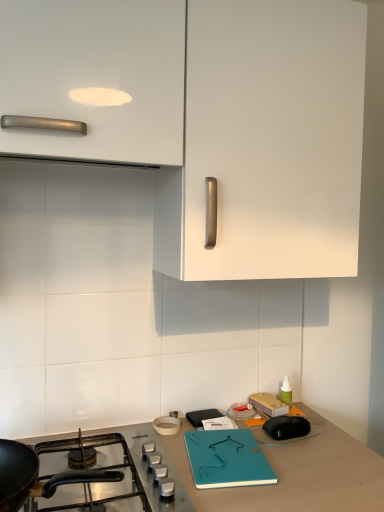
Image resolution: width=384 pixels, height=512 pixels. What do you see at coordinates (70, 476) in the screenshot?
I see `black matte gas stove at lower left` at bounding box center [70, 476].

What is the approximate width of black matte gas stove at lower left?

It is 11.25 inches.

Find the location of a particular element. This screenshot has width=384, height=512. black matte gas stove at lower left is located at coordinates (70, 476).

Describe the element at coordinates (209, 120) in the screenshot. The image size is (384, 512). I see `white matte cabinet at upper center` at that location.

Find the location of `white matte cabinet at upper center`. white matte cabinet at upper center is located at coordinates (209, 120).

Find the location of `black matte gas stove at lower left`. black matte gas stove at lower left is located at coordinates (70, 476).

Can you confirm if white matte cabinet at upper center is positioned to the right of black matte gas stove at lower left?

Correct, you'll find white matte cabinet at upper center to the right of black matte gas stove at lower left.

Which object is closer to the camera taking this photo, white matte cabinet at upper center or black matte gas stove at lower left?

black matte gas stove at lower left is in front.

In the scene shown: Which point is more distant from viewer, (x=131, y=78) or (x=15, y=483)?

The point (x=131, y=78) is farther.

From the image's perspective, who appears lower, white matte cabinet at upper center or black matte gas stove at lower left?

black matte gas stove at lower left.

From a real-world perspective, is white matte cabinet at upper center located higher than black matte gas stove at lower left?

Yes.

Considering the sizes of objects white matte cabinet at upper center and black matte gas stove at lower left in the image provided, who is thinner, white matte cabinet at upper center or black matte gas stove at lower left?

black matte gas stove at lower left.

Who is shorter, white matte cabinet at upper center or black matte gas stove at lower left?

black matte gas stove at lower left is shorter.

Considering the sizes of objects white matte cabinet at upper center and black matte gas stove at lower left in the image provided, who is bigger, white matte cabinet at upper center or black matte gas stove at lower left?

white matte cabinet at upper center.

Which is correct: white matte cabinet at upper center is inside black matte gas stove at lower left, or outside of it?

white matte cabinet at upper center is located beyond the bounds of black matte gas stove at lower left.

Consider the image. Is white matte cabinet at upper center far from black matte gas stove at lower left?

That's not correct — white matte cabinet at upper center is a little close to black matte gas stove at lower left.

Is white matte cabinet at upper center facing towards black matte gas stove at lower left?

No.

Looking at this image, how different are the orientations of white matte cabinet at upper center and black matte gas stove at lower left in degrees?

white matte cabinet at upper center and black matte gas stove at lower left are facing 0.00554 degrees away from each other.

This screenshot has width=384, height=512. Find the location of `cabinetry that appears on the right of black matte gas stove at lower left`. cabinetry that appears on the right of black matte gas stove at lower left is located at coordinates (209, 120).

Which is more to the right, black matte gas stove at lower left or white matte cabinet at upper center?

From the viewer's perspective, white matte cabinet at upper center appears more on the right side.

Which object is closer to the camera, black matte gas stove at lower left or white matte cabinet at upper center?

black matte gas stove at lower left is more forward.

Between point (139, 479) and point (348, 170), which one is positioned in front?

The point (139, 479) is closer to the camera.

From the image's perspective, between black matte gas stove at lower left and white matte cabinet at upper center, who is located below?

From the image's view, black matte gas stove at lower left is below.

From a real-world perspective, does black matte gas stove at lower left stand above white matte cabinet at upper center?

No, from a real-world perspective, black matte gas stove at lower left is not over white matte cabinet at upper center

Looking at their sizes, would you say black matte gas stove at lower left is wider or thinner than white matte cabinet at upper center?

black matte gas stove at lower left is thinner than white matte cabinet at upper center.

Looking at this image, can you confirm if black matte gas stove at lower left is taller than white matte cabinet at upper center?

In fact, black matte gas stove at lower left may be shorter than white matte cabinet at upper center.

Considering the relative sizes of black matte gas stove at lower left and white matte cabinet at upper center in the image provided, is black matte gas stove at lower left bigger than white matte cabinet at upper center?

Incorrect, black matte gas stove at lower left is not larger than white matte cabinet at upper center.

Choose the correct answer: Is black matte gas stove at lower left inside white matte cabinet at upper center or outside it?

black matte gas stove at lower left lies outside white matte cabinet at upper center.

Is the surface of black matte gas stove at lower left in direct contact with white matte cabinet at upper center?

No, black matte gas stove at lower left is not beside white matte cabinet at upper center.

Is black matte gas stove at lower left oriented towards white matte cabinet at upper center?

No.

What's the angular difference between black matte gas stove at lower left and white matte cabinet at upper center's facing directions?

black matte gas stove at lower left and white matte cabinet at upper center are facing 0.00554 degrees away from each other.

Where is `cabinetry behind the black matte gas stove at lower left`? The image size is (384, 512). cabinetry behind the black matte gas stove at lower left is located at coordinates (209, 120).

Where is `cabinetry that is above the black matte gas stove at lower left (from a real-world perspective)`? The image size is (384, 512). cabinetry that is above the black matte gas stove at lower left (from a real-world perspective) is located at coordinates (209, 120).

You are a GUI agent. You are given a task and a screenshot of the screen. Output one action in this format:
    pyautogui.click(x=<x>, y=<y>)
    Task: Click on the cabinetry on the right of black matte gas stove at lower left
    
    Given the screenshot: What is the action you would take?
    pyautogui.click(x=209, y=120)